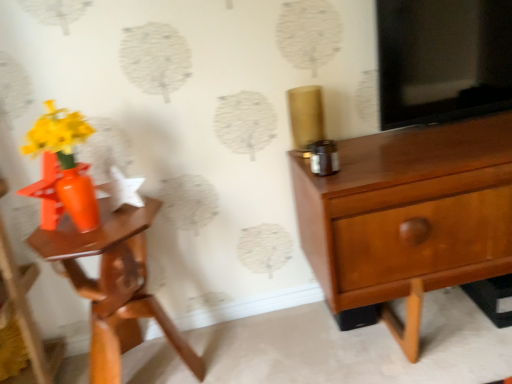
Question: Can you confirm if matte wood chest of drawers at right is positioned to the right of matte orange nightstand at left?

Choices:
 (A) yes
 (B) no

Answer: (A)

Question: Can you confirm if matte wood chest of drawers at right is taller than matte orange nightstand at left?

Choices:
 (A) no
 (B) yes

Answer: (B)

Question: Is matte wood chest of drawers at right located outside matte orange nightstand at left?

Choices:
 (A) yes
 (B) no

Answer: (A)

Question: From the image's perspective, does matte wood chest of drawers at right appear lower than matte orange nightstand at left?

Choices:
 (A) yes
 (B) no

Answer: (B)

Question: From a real-world perspective, does matte wood chest of drawers at right sit lower than matte orange nightstand at left?

Choices:
 (A) yes
 (B) no

Answer: (B)

Question: Is matte wood chest of drawers at right smaller than matte orange nightstand at left?

Choices:
 (A) no
 (B) yes

Answer: (A)

Question: Considering the relative sizes of matte orange nightstand at left and matte wood chest of drawers at right in the image provided, is matte orange nightstand at left thinner than matte wood chest of drawers at right?

Choices:
 (A) yes
 (B) no

Answer: (A)

Question: Considering the relative sizes of matte orange nightstand at left and matte wood chest of drawers at right in the image provided, is matte orange nightstand at left bigger than matte wood chest of drawers at right?

Choices:
 (A) yes
 (B) no

Answer: (B)

Question: From the image's perspective, is matte orange nightstand at left under matte wood chest of drawers at right?

Choices:
 (A) no
 (B) yes

Answer: (B)

Question: From the image's perspective, is matte orange nightstand at left located above matte wood chest of drawers at right?

Choices:
 (A) no
 (B) yes

Answer: (A)

Question: Is matte orange nightstand at left not near matte wood chest of drawers at right?

Choices:
 (A) no
 (B) yes

Answer: (A)

Question: Does matte orange nightstand at left have a lesser height compared to matte wood chest of drawers at right?

Choices:
 (A) no
 (B) yes

Answer: (B)

Question: From a real-world perspective, is orange glossy vase at left on top of matte orange nightstand at left?

Choices:
 (A) no
 (B) yes

Answer: (B)